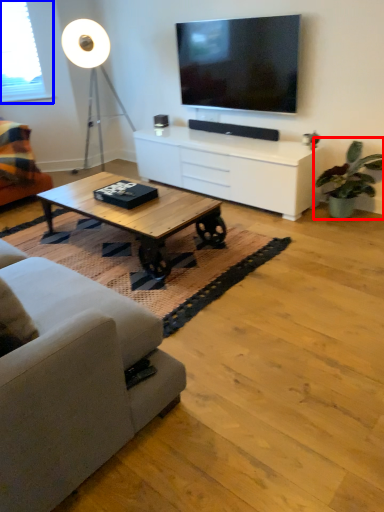
Question: Among these objects, which one is nearest to the camera, houseplant (highlighted by a red box) or window screen (highlighted by a blue box)?

Choices:
 (A) houseplant
 (B) window screen

Answer: (A)